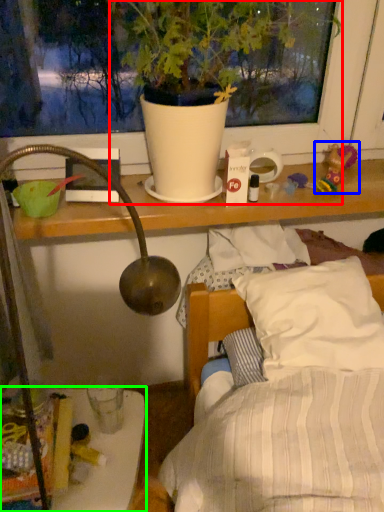
Question: Which is farther away from houseplant (highlighted by a red box)? toy (highlighted by a blue box) or furniture (highlighted by a green box)?

Choices:
 (A) toy
 (B) furniture

Answer: (B)